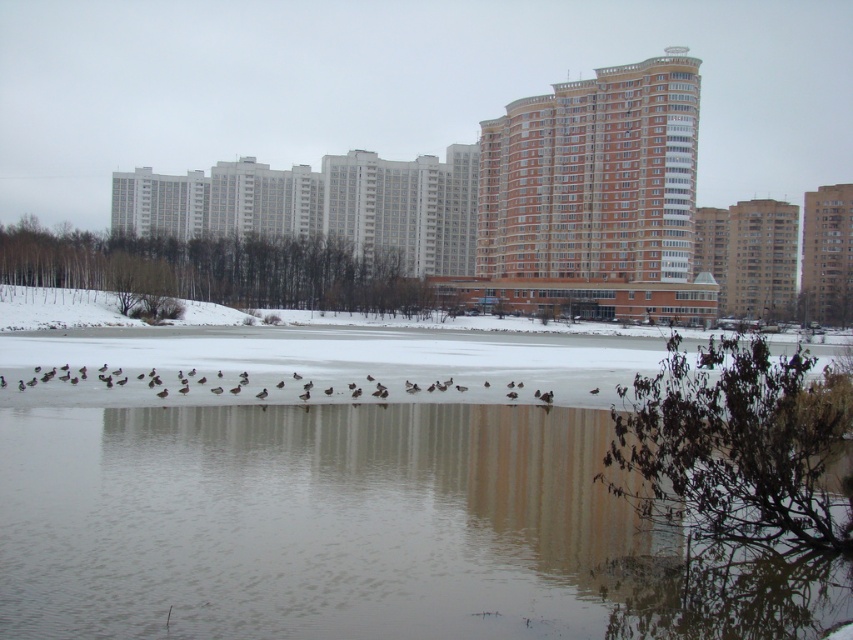
You are a photographer standing at the edge of the frozen lake. You want to capture a photo of the brown matte birds at center while ensuring the clear water at center is also visible in the frame. Given that your camera has a maximum focus range of 10 meters, will you be able to focus on both subjects simultaneously?

The clear water at center is 11.23 meters from the brown matte birds at center. Since the camera can only focus up to 10 meters, the distance between them exceeds the focus range. Therefore, you cannot focus on both subjects simultaneously.

You are an environmental scientist assessing water clarity in the frozen lake. You observe the clear water at center and the brown matte birds at center. Which object appears to have a greater thickness in the image?

The brown matte birds at center are thicker than the clear water at center, as the clear water at center is described as thinner.